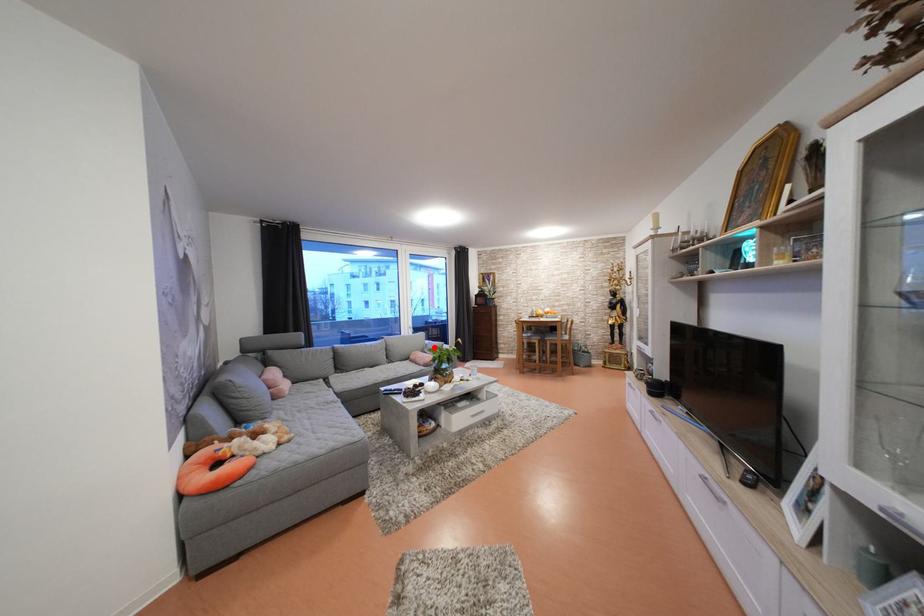
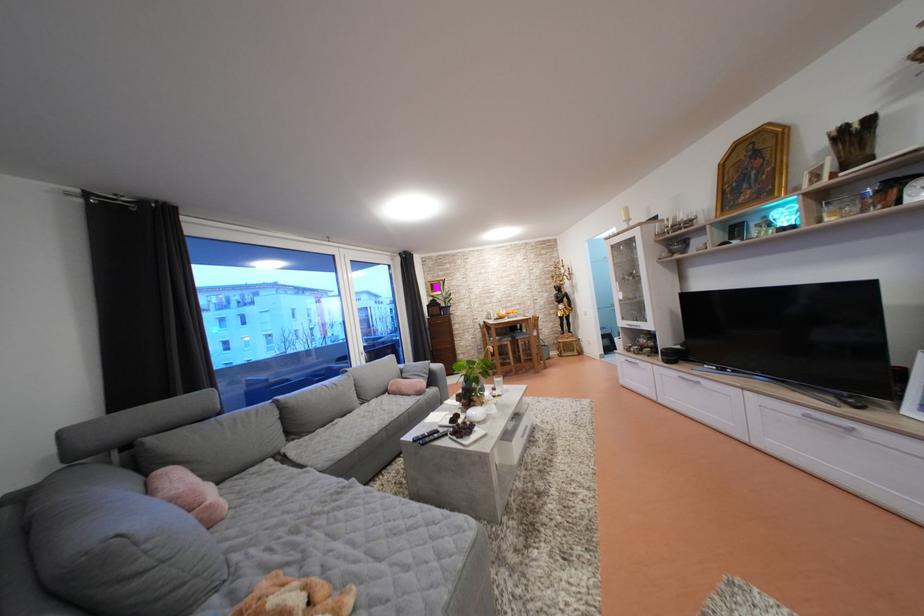
Where in the second image is the point corresponding to the highlighted location from the first image?

(408, 371)